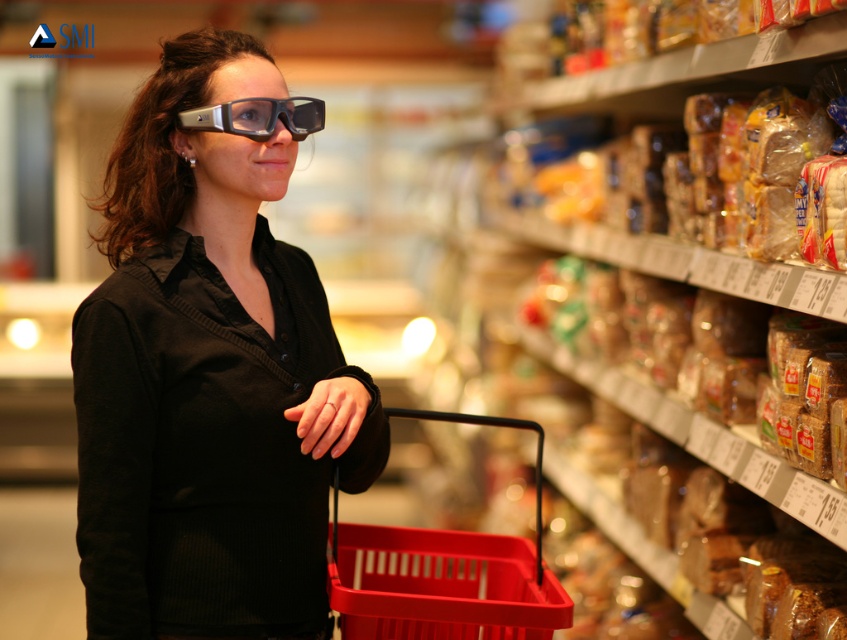
Is the position of matte plastic basket at lower center more distant than that of matte black glasses at center?

No, matte plastic basket at lower center is closer to the viewer.

Who is shorter, matte plastic basket at lower center or matte black glasses at center?

With less height is matte black glasses at center.

Does point (380, 576) come in front of point (248, 129)?

No, it is not.

Where is `matte plastic basket at lower center`? The image size is (847, 640). matte plastic basket at lower center is located at coordinates (441, 572).

Is matte black shirt at center to the left of translucent plastic bread at upper right from the viewer's perspective?

Correct, you'll find matte black shirt at center to the left of translucent plastic bread at upper right.

Does matte black shirt at center lie behind translucent plastic bread at upper right?

No.

At what (x,y) coordinates should I click in order to perform the action: click on matte black shirt at center. Please return your answer as a coordinate pair (x, y). The image size is (847, 640). Looking at the image, I should click on (209, 376).

Between matte black shirt at center and matte black glasses at center, which one is positioned higher?

Positioned higher is matte black glasses at center.

Can you confirm if matte black shirt at center is shorter than matte black glasses at center?

No, matte black shirt at center is not shorter than matte black glasses at center.

Does point (278, 440) come in front of point (263, 115)?

Yes, it is.

I want to click on matte black shirt at center, so click(x=209, y=376).